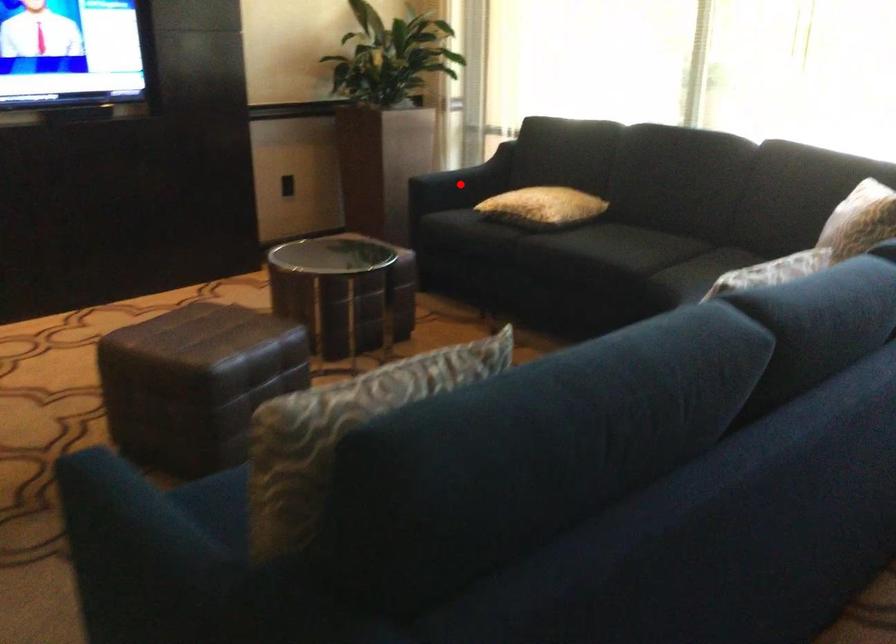
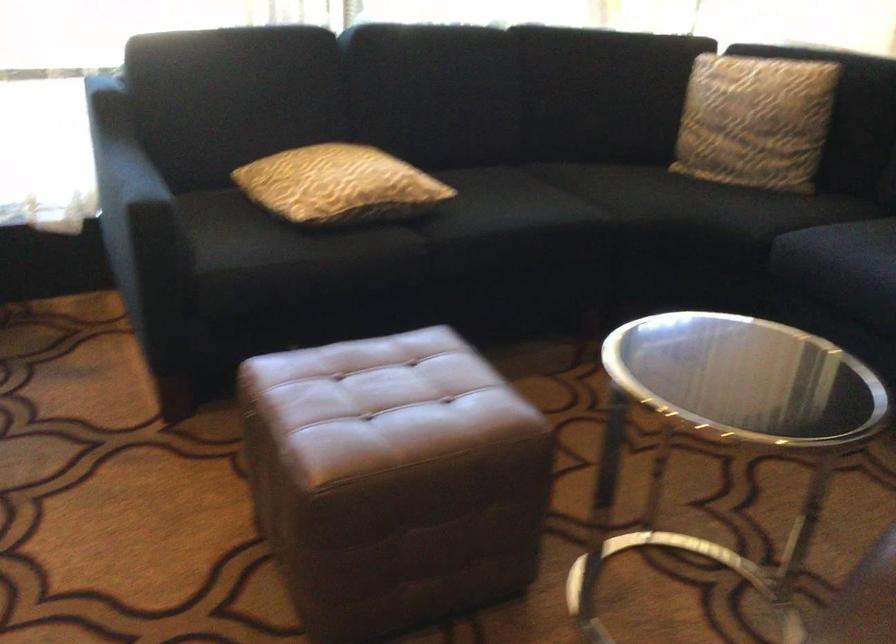
Question: I am providing you with two images of the same scene from different viewpoints. A red point is shown in image1. For the corresponding object point in image2, is it positioned nearer or farther from the camera?

Choices:
 (A) Nearer
 (B) Farther

Answer: (A)